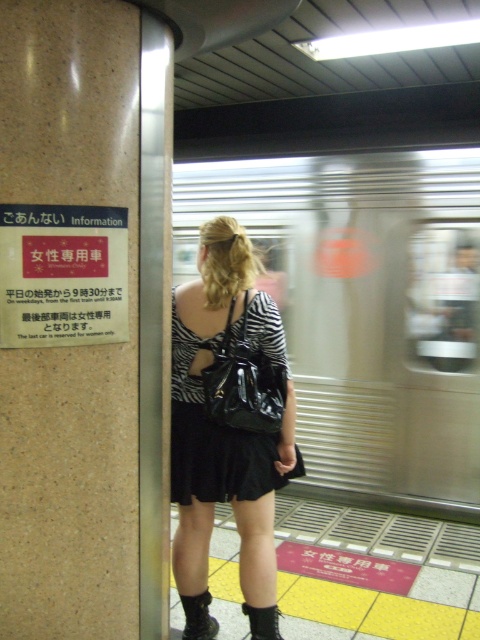
Question: Which point is farther to the camera?

Choices:
 (A) zebra print dress at center
 (B) granite-like pillar at left
 (C) black leather boot at lower center
 (D) silver metallic train at center

Answer: (D)

Question: Does glossy black handbag at center have a larger size compared to black leather boot at lower center?

Choices:
 (A) no
 (B) yes

Answer: (B)

Question: Is the position of black leather boot at lower center more distant than that of black patent leather boot at lower center?

Choices:
 (A) no
 (B) yes

Answer: (B)

Question: Does granite-like pillar at left have a greater width compared to black patent leather boot at lower center?

Choices:
 (A) no
 (B) yes

Answer: (B)

Question: Which is farther from the black leather boot at lower center?

Choices:
 (A) zebra print dress at center
 (B) black patent leather boot at lower center
 (C) glossy black handbag at center
 (D) black satin dress at center

Answer: (C)

Question: Which object is farther from the camera taking this photo?

Choices:
 (A) granite-like pillar at left
 (B) glossy black handbag at center
 (C) black leather boot at lower center

Answer: (C)